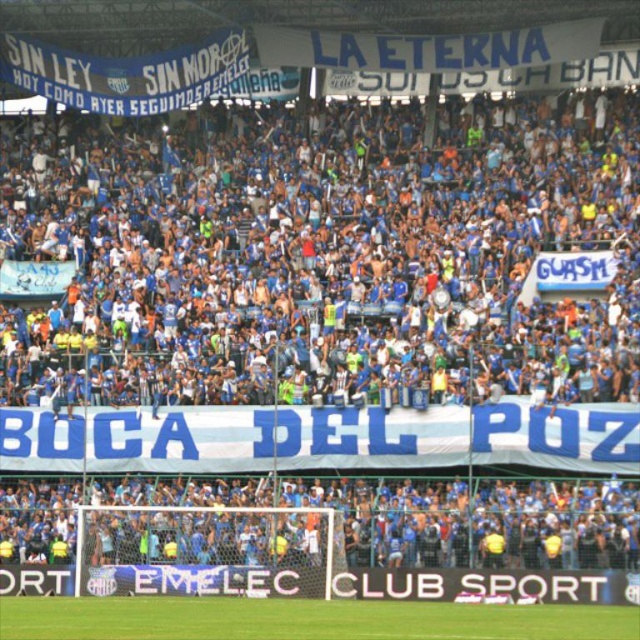
Question: Is blue fabric banner at upper center behind blue jersey at lower center?

Choices:
 (A) no
 (B) yes

Answer: (B)

Question: Does blue fabric banner at upper center appear over blue jersey at lower center?

Choices:
 (A) yes
 (B) no

Answer: (A)

Question: Among these objects, which one is nearest to the camera?

Choices:
 (A) blue jersey at lower center
 (B) blue fabric banner at upper center

Answer: (A)

Question: Observing the image, what is the correct spatial positioning of blue fabric banner at upper center in reference to blue jersey at lower center?

Choices:
 (A) left
 (B) right

Answer: (A)